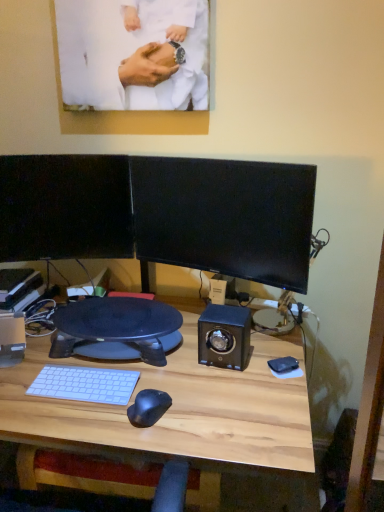
Find the location of a particular element. The image size is (384, 512). matte white shirt at upper center is located at coordinates (175, 40).

This screenshot has width=384, height=512. Describe the element at coordinates (175, 40) in the screenshot. I see `matte white shirt at upper center` at that location.

This screenshot has width=384, height=512. I want to click on matte white shirt at upper center, so click(175, 40).